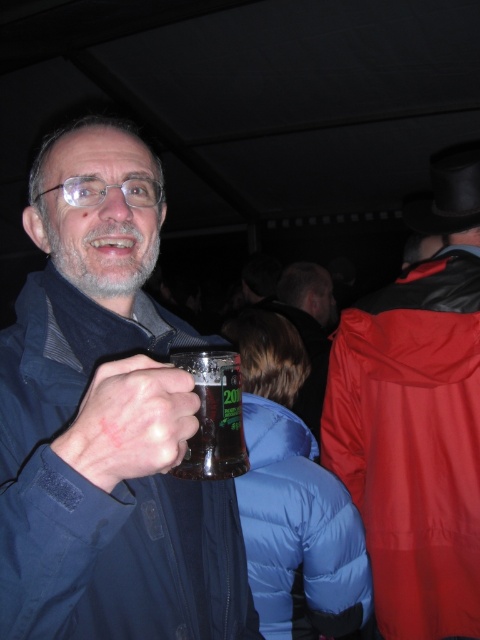
You are a bartender at a party and need to place a new drink order. You see the point at coordinates (107,420) in the image. What object is located at that point?

The point at coordinates (107,420) indicates the matte glass mug at center.

You are at a night gathering and want to grab the translucent glass mug at center without touching the matte black jacket at center. Is it possible?

Yes, the translucent glass mug at center is to the left of the matte black jacket at center, so you can reach it without touching the jacket.